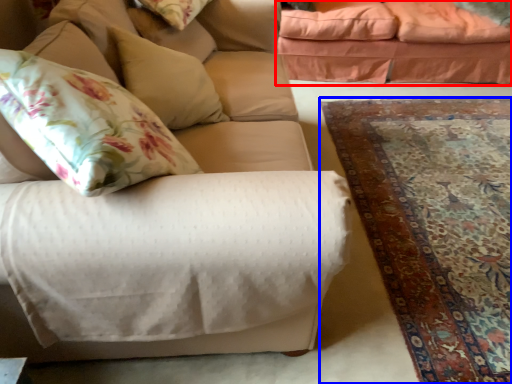
Question: Which object is further to the camera taking this photo, studio couch (highlighted by a red box) or mat (highlighted by a blue box)?

Choices:
 (A) studio couch
 (B) mat

Answer: (A)